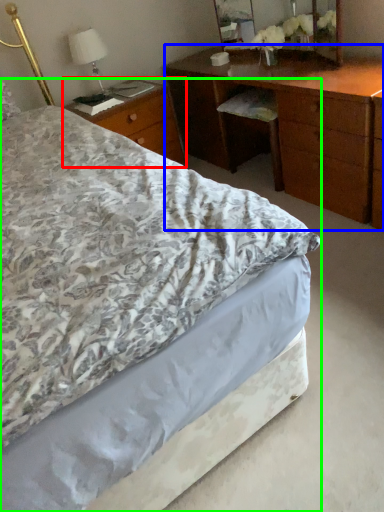
Question: Which object is positioned closest to nightstand (highlighted by a red box)? Select from desk (highlighted by a blue box) and bed (highlighted by a green box).

Choices:
 (A) desk
 (B) bed

Answer: (A)